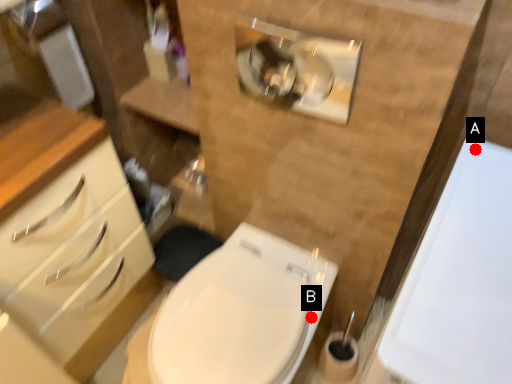
Question: Two points are circled on the image, labeled by A and B beside each circle. Which point is closer to the camera?

Choices:
 (A) A is closer
 (B) B is closer

Answer: (A)